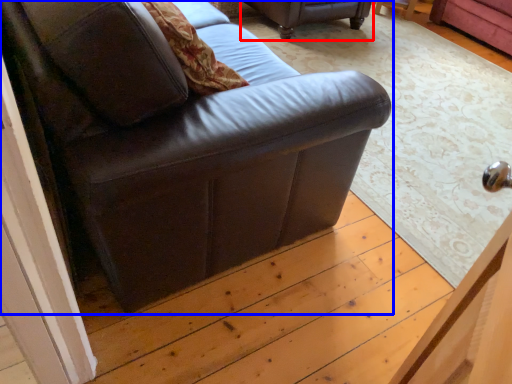
Question: Which of the following is the closest to the observer, studio couch (highlighted by a red box) or studio couch (highlighted by a blue box)?

Choices:
 (A) studio couch
 (B) studio couch

Answer: (B)